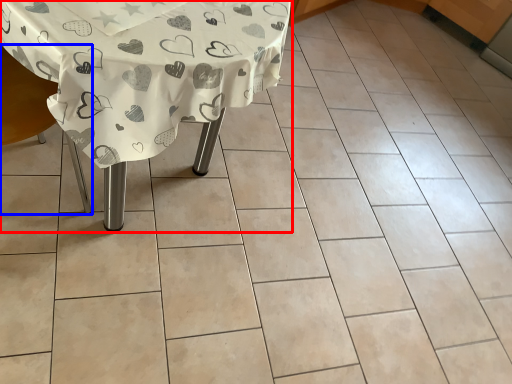
Question: Among these objects, which one is farthest to the camera, table (highlighted by a red box) or armchair (highlighted by a blue box)?

Choices:
 (A) table
 (B) armchair

Answer: (A)